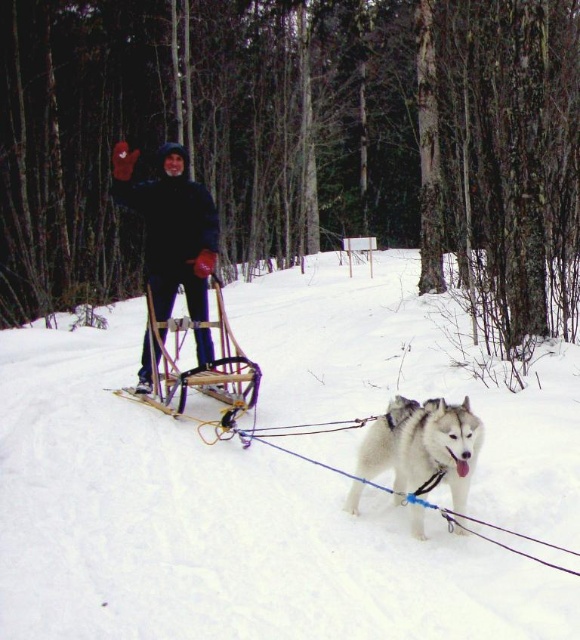
Question: Which point is farther to the camera?

Choices:
 (A) (215, 234)
 (B) (106, 410)

Answer: (A)

Question: Is white fluffy snow at center smaller than white fur dog at center?

Choices:
 (A) no
 (B) yes

Answer: (A)

Question: Is white fluffy snow at center to the left of white fur dog at center from the viewer's perspective?

Choices:
 (A) yes
 (B) no

Answer: (A)

Question: Does black fabric jacket at center appear under white fur dog at center?

Choices:
 (A) no
 (B) yes

Answer: (A)

Question: Which of the following is the closest to the observer?

Choices:
 (A) white fluffy snow at center
 (B) white fur dog at center

Answer: (A)

Question: Among these points, which one is farthest from the camera?

Choices:
 (A) (438, 449)
 (B) (219, 630)

Answer: (A)